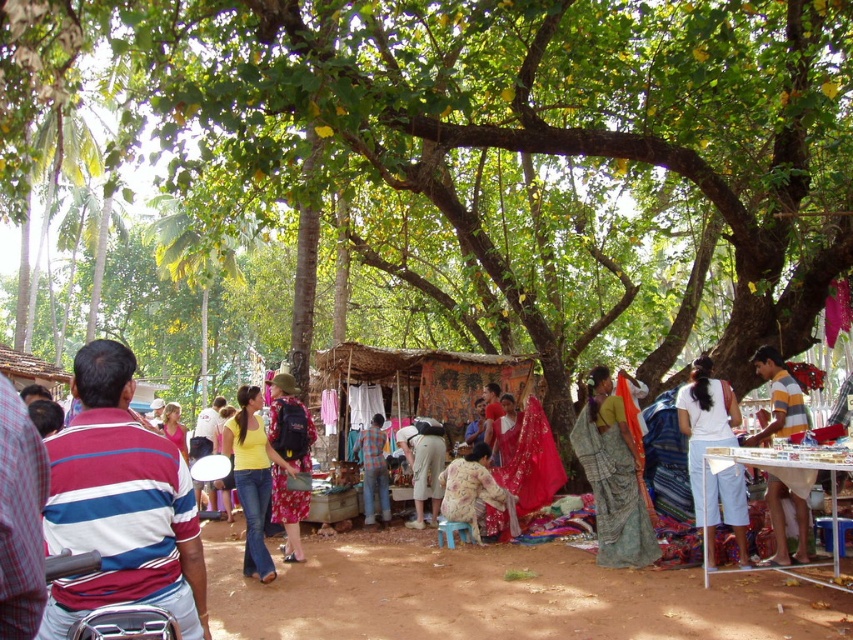
Question: Which point is closer to the camera?

Choices:
 (A) (381, 513)
 (B) (463, 499)
 (C) (650, 525)

Answer: (C)

Question: Which point is farther from the camera taking this photo?

Choices:
 (A) (351, 582)
 (B) (386, 474)

Answer: (B)

Question: Among these points, which one is nearest to the camera?

Choices:
 (A) (264, 598)
 (B) (428, 483)
 (C) (178, 419)

Answer: (A)

Question: Is textile fabric stall at center smaller than floral fabric dress at center?

Choices:
 (A) yes
 (B) no

Answer: (A)

Question: Considering the relative positions of textile fabric stall at center and pink fabric dress at center in the image provided, where is textile fabric stall at center located with respect to pink fabric dress at center?

Choices:
 (A) left
 (B) right

Answer: (B)

Question: Is green leafy tree at center in front of checkered fabric shirt at center?

Choices:
 (A) no
 (B) yes

Answer: (B)